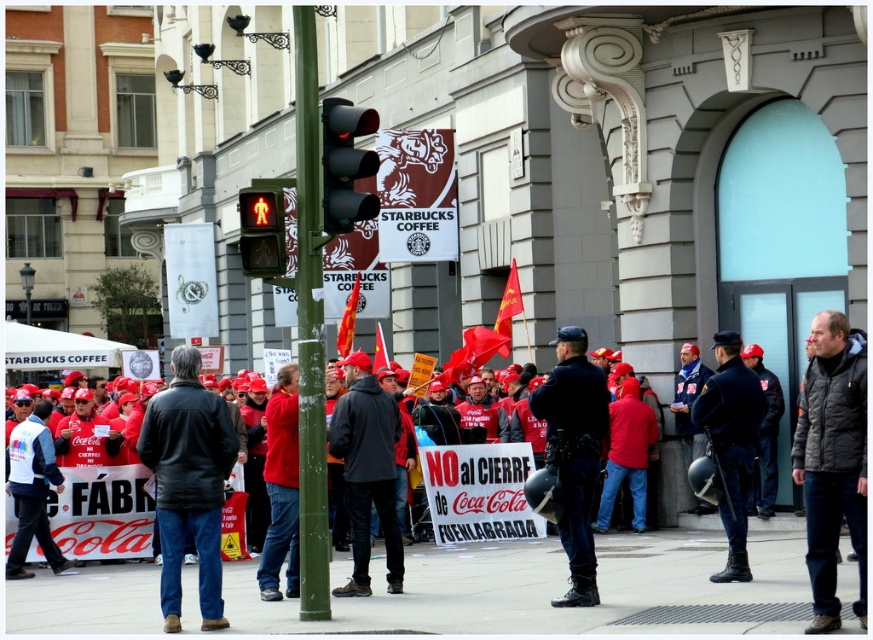
Who is positioned more to the left, black leather jacket at center or black matte traffic light at center?

Positioned to the left is black leather jacket at center.

Is black leather jacket at center wider than black matte traffic light at center?

Indeed, black leather jacket at center has a greater width compared to black matte traffic light at center.

This screenshot has width=873, height=640. I want to click on black leather jacket at center, so click(188, 483).

Between point (320, 580) and point (282, 220), which one is positioned behind?

Point (282, 220)

Which of these two, green textured pole at center or red glass pedestrian signal at upper center, stands shorter?

red glass pedestrian signal at upper center

Is point (317, 157) positioned after point (262, 216)?

No, (317, 157) is closer to viewer.

Find the location of a particular element. The image size is (873, 640). green textured pole at center is located at coordinates (308, 324).

Which is behind, point (829, 449) or point (325, 605)?

The point (325, 605) is more distant.

Who is more distant from viewer, (825, 449) or (304, 316)?

The point (304, 316) is more distant.

The image size is (873, 640). Identify the location of dark gray textured jacket at lower right. (832, 460).